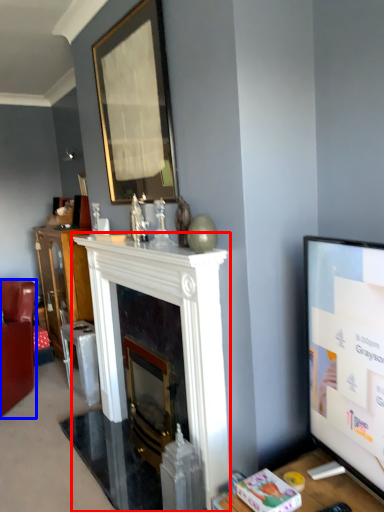
Question: Which of the following is the farthest to the observer, fireplace (highlighted by a red box) or chair (highlighted by a blue box)?

Choices:
 (A) fireplace
 (B) chair

Answer: (B)